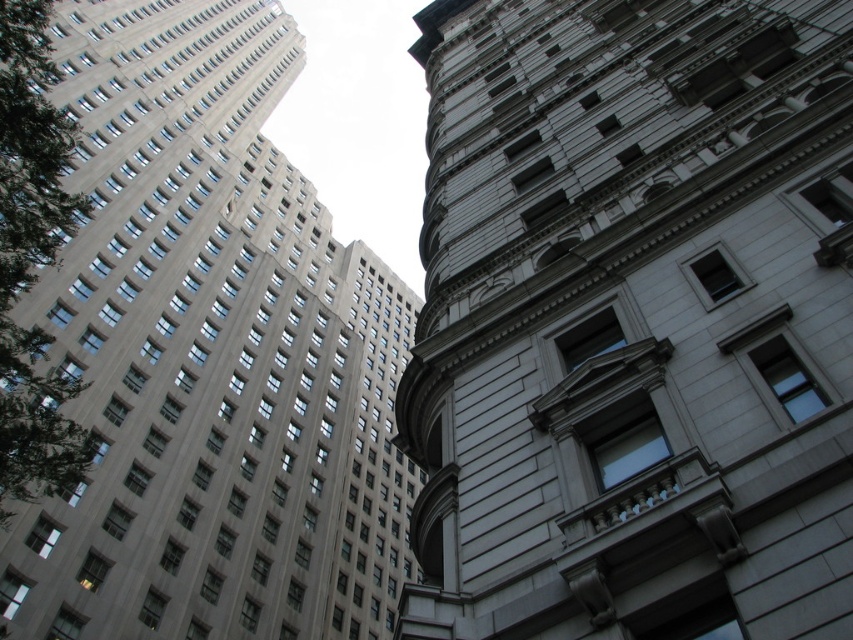
You are standing at the origin point in the image. Which direction should you move to reach the white stone building at center?

The white stone building at center is located at coordinates 0.503 in the x direction and 0.743 in the y direction. Since the origin is at the bottom left corner, you should move to the right and upwards to reach it.

You are an urban planner assessing the distance between two buildings in a city. The white stone building at center and the gray stone building at upper left are part of a proposed development plan. The city requires that all new buildings must be at least 50 meters apart for safety regulations. Based on the image, do these two buildings meet the required distance apart?

The white stone building at center is 47.14 meters from the gray stone building at upper left. Since 47.14 meters is less than the required 50 meters, the buildings do not meet the safety distance requirement.